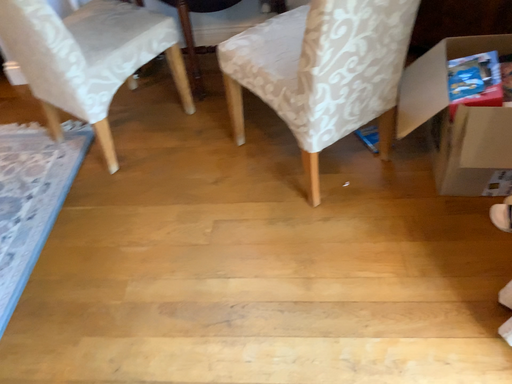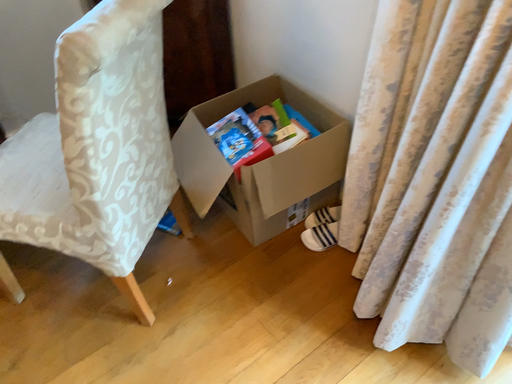
Question: How did the camera likely rotate when shooting the video?

Choices:
 (A) rotated upward
 (B) rotated downward

Answer: (A)